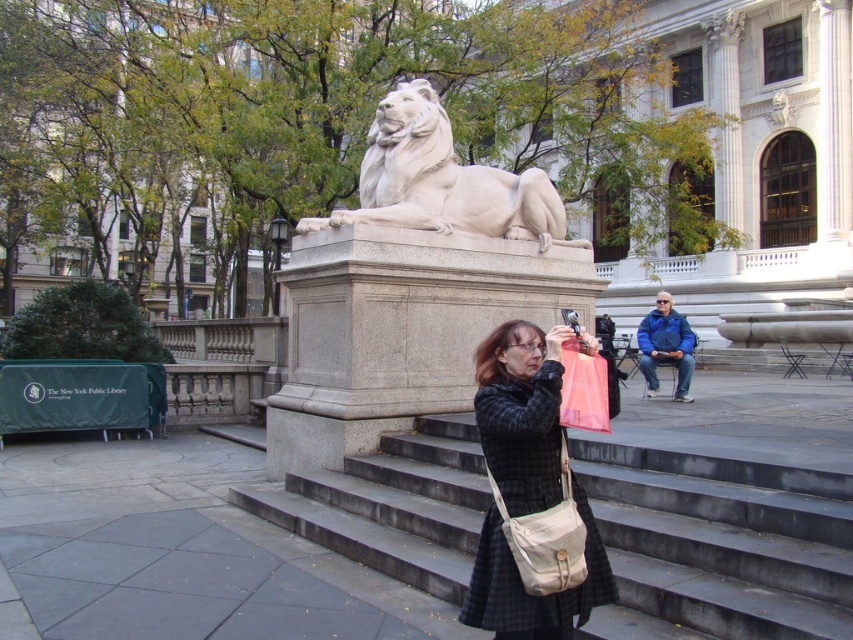
Does point (340, 211) come closer to viewer compared to point (668, 355)?

Yes.

Does white marble lion at center lie in front of blue fleece jacket at lower right?

That is True.

This screenshot has height=640, width=853. What are the coordinates of `white marble lion at center` in the screenshot? It's located at (444, 180).

Can you confirm if smooth concrete stairs at center is wider than matte black coat at center?

Yes.

Does smooth concrete stairs at center appear under matte black coat at center?

Indeed, smooth concrete stairs at center is positioned under matte black coat at center.

Between point (821, 561) and point (495, 595), which one is positioned behind?

The point (821, 561) is more distant.

At what (x,y) coordinates should I click in order to perform the action: click on smooth concrete stairs at center. Please return your answer as a coordinate pair (x, y). Looking at the image, I should click on (718, 545).

Which of these two, matte black coat at center or blue fleece jacket at lower right, stands shorter?

With less height is matte black coat at center.

Does point (482, 552) come closer to viewer compared to point (683, 330)?

Yes, point (482, 552) is in front of point (683, 330).

Between point (479, 348) and point (659, 337), which one is positioned behind?

Point (659, 337)

This screenshot has width=853, height=640. I want to click on matte black coat at center, so click(521, 412).